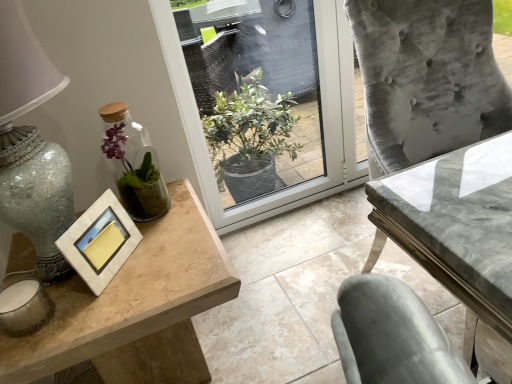
Question: Does transparent glass window at center have a lesser width compared to wooden table at left, marked as the second table in a right-to-left arrangement?

Choices:
 (A) yes
 (B) no

Answer: (A)

Question: Is transparent glass window at center positioned beyond the bounds of wooden table at left, which is the 1th table in left-to-right order?

Choices:
 (A) no
 (B) yes

Answer: (B)

Question: From a real-world perspective, is transparent glass window at center beneath wooden table at left, marked as the second table in a right-to-left arrangement?

Choices:
 (A) no
 (B) yes

Answer: (A)

Question: Is transparent glass window at center in contact with wooden table at left, marked as the second table in a right-to-left arrangement?

Choices:
 (A) yes
 (B) no

Answer: (B)

Question: From a real-world perspective, is transparent glass window at center physically above wooden table at left, marked as the second table in a right-to-left arrangement?

Choices:
 (A) no
 (B) yes

Answer: (B)

Question: Relative to matte silver picture frame at left, is marble gray table at center, which ranks as the first table in right-to-left order, in front or behind?

Choices:
 (A) front
 (B) behind

Answer: (A)

Question: Based on their sizes in the image, would you say marble gray table at center, which is the second table in left-to-right order, is bigger or smaller than matte silver picture frame at left?

Choices:
 (A) small
 (B) big

Answer: (B)

Question: Considering the positions of point (503, 344) and point (114, 235), is point (503, 344) closer or farther from the camera than point (114, 235)?

Choices:
 (A) farther
 (B) closer

Answer: (A)

Question: In terms of height, does marble gray table at center, which is the second table in left-to-right order, look taller or shorter compared to matte silver picture frame at left?

Choices:
 (A) tall
 (B) short

Answer: (A)

Question: Is point (372, 264) positioned closer to the camera than point (330, 3)?

Choices:
 (A) closer
 (B) farther

Answer: (A)

Question: Do you think marble gray table at center, which ranks as the first table in right-to-left order, is within transparent glass window at center, or outside of it?

Choices:
 (A) inside
 (B) outside

Answer: (B)

Question: Considering the relative positions of marble gray table at center, which is the second table in left-to-right order, and transparent glass window at center in the image provided, is marble gray table at center, which is the second table in left-to-right order, to the left or to the right of transparent glass window at center?

Choices:
 (A) left
 (B) right

Answer: (B)

Question: Looking at their shapes, would you say marble gray table at center, which is the second table in left-to-right order, is wider or thinner than transparent glass window at center?

Choices:
 (A) wide
 (B) thin

Answer: (A)

Question: From the image's perspective, relative to clear glass vase at left, is wooden table at left, marked as the second table in a right-to-left arrangement, above or below?

Choices:
 (A) below
 (B) above

Answer: (A)

Question: Does point (168, 314) appear closer or farther from the camera than point (123, 195)?

Choices:
 (A) farther
 (B) closer

Answer: (B)